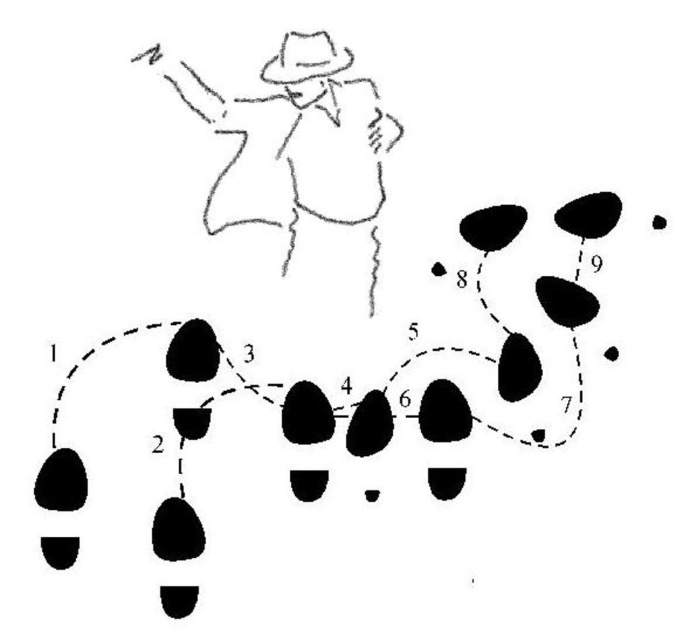
You are standing 5 feet away from the camera and looking at the image. Can you see the black line drawing man at upper left clearly?

The black line drawing man at upper left is 3.67 feet from camera, so yes, you can see it clearly since you are standing 5 feet away from the camera which is farther than the man, meaning the man is closer to the camera and thus visible.

You are an observer standing in front of the image. You notice the black rubber footprints at lower left and the black line drawing man at upper left. Which object is closer to you?

The black rubber footprints at lower left is in front of the black line drawing man at upper left, so it is closer to you.

You are a dance instructor analyzing a student performance. The student is following a dance routine with numbered footprints arranged in a circle. The dance instructor wants to know where the center of the circle formed by the footprints is located. The student claims the center is at point (444,412). Is the student correct?

The point (444,412) corresponds to black rubber footprints at lower left, so the student is incorrect because the center should be equidistant from all footprints, not at a specific footprint location.